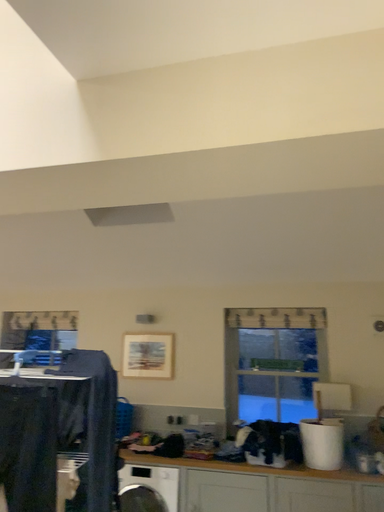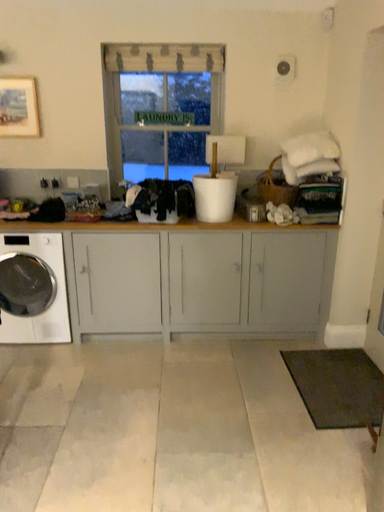
Question: How did the camera likely rotate when shooting the video?

Choices:
 (A) rotated left
 (B) rotated right

Answer: (B)